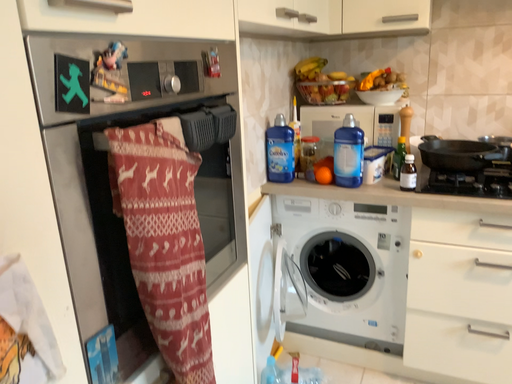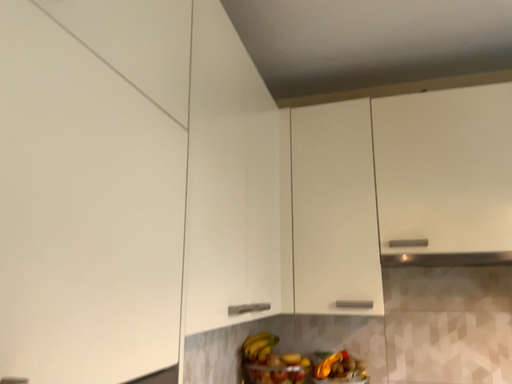
Question: Which way did the camera rotate in the video?

Choices:
 (A) rotated right
 (B) rotated left

Answer: (A)